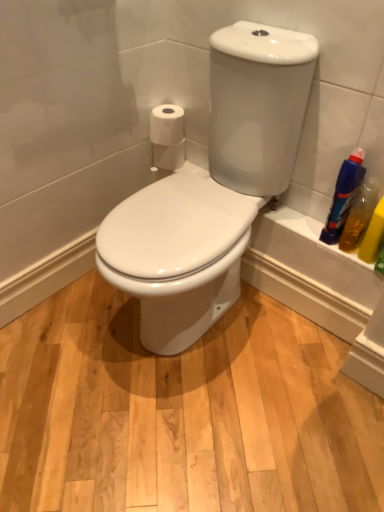
Question: Can you confirm if white matte toilet paper at upper right, positioned as the 1th toilet paper in top-to-bottom order, is positioned to the right of yellow translucent bottle at right, acting as the second cleaning product starting from the left?

Choices:
 (A) no
 (B) yes

Answer: (A)

Question: Are white matte toilet paper at upper right, positioned as the 1th toilet paper in top-to-bottom order, and yellow translucent bottle at right, acting as the second cleaning product starting from the left, beside each other?

Choices:
 (A) no
 (B) yes

Answer: (A)

Question: From the image's perspective, does white matte toilet paper at upper right, positioned as the 1th toilet paper in top-to-bottom order, appear higher than yellow translucent bottle at right, which is counted as the 1th cleaning product, starting from the right?

Choices:
 (A) no
 (B) yes

Answer: (B)

Question: Can you confirm if white matte toilet paper at upper right, positioned as the 1th toilet paper in top-to-bottom order, is wider than yellow translucent bottle at right, acting as the second cleaning product starting from the left?

Choices:
 (A) yes
 (B) no

Answer: (A)

Question: Is white matte toilet paper at upper right, the second toilet paper positioned from the bottom, far away from yellow translucent bottle at right, which is counted as the 1th cleaning product, starting from the right?

Choices:
 (A) no
 (B) yes

Answer: (A)

Question: Is white matte toilet paper at upper right, positioned as the 1th toilet paper in top-to-bottom order, bigger or smaller than yellow translucent bottle at right, acting as the second cleaning product starting from the left?

Choices:
 (A) big
 (B) small

Answer: (A)

Question: Would you say white matte toilet paper at upper right, positioned as the 1th toilet paper in top-to-bottom order, is inside or outside yellow translucent bottle at right, which is counted as the 1th cleaning product, starting from the right?

Choices:
 (A) outside
 (B) inside

Answer: (A)

Question: From a real-world perspective, is white matte toilet paper at upper right, positioned as the 1th toilet paper in top-to-bottom order, physically located above or below yellow translucent bottle at right, acting as the second cleaning product starting from the left?

Choices:
 (A) below
 (B) above

Answer: (B)

Question: In terms of width, does white matte toilet paper at upper right, positioned as the 1th toilet paper in top-to-bottom order, look wider or thinner when compared to yellow translucent bottle at right, which is counted as the 1th cleaning product, starting from the right?

Choices:
 (A) wide
 (B) thin

Answer: (A)

Question: Is blue plastic bottle at right, the second cleaning product in the right-to-left sequence, in front of or behind white glossy toilet at center in the image?

Choices:
 (A) behind
 (B) front

Answer: (A)

Question: Does point (337, 180) appear closer or farther from the camera than point (228, 218)?

Choices:
 (A) farther
 (B) closer

Answer: (A)

Question: In terms of size, does blue plastic bottle at right, the second cleaning product in the right-to-left sequence, appear bigger or smaller than white glossy toilet at center?

Choices:
 (A) big
 (B) small

Answer: (B)

Question: From the image's perspective, is blue plastic bottle at right, placed as the first cleaning product when sorted from left to right, located above or below white glossy toilet at center?

Choices:
 (A) above
 (B) below

Answer: (A)

Question: In terms of size, does white matte toilet paper at upper right, the second toilet paper positioned from the bottom, appear bigger or smaller than white glossy toilet at center?

Choices:
 (A) big
 (B) small

Answer: (B)

Question: Is white matte toilet paper at upper right, positioned as the 1th toilet paper in top-to-bottom order, inside or outside of white glossy toilet at center?

Choices:
 (A) inside
 (B) outside

Answer: (B)